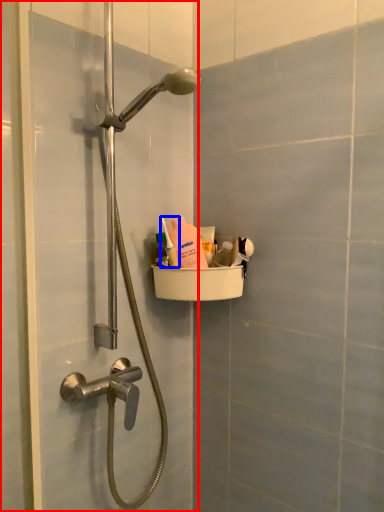
Question: Which object is further to the camera taking this photo, screen door (highlighted by a red box) or toiletry (highlighted by a blue box)?

Choices:
 (A) screen door
 (B) toiletry

Answer: (B)